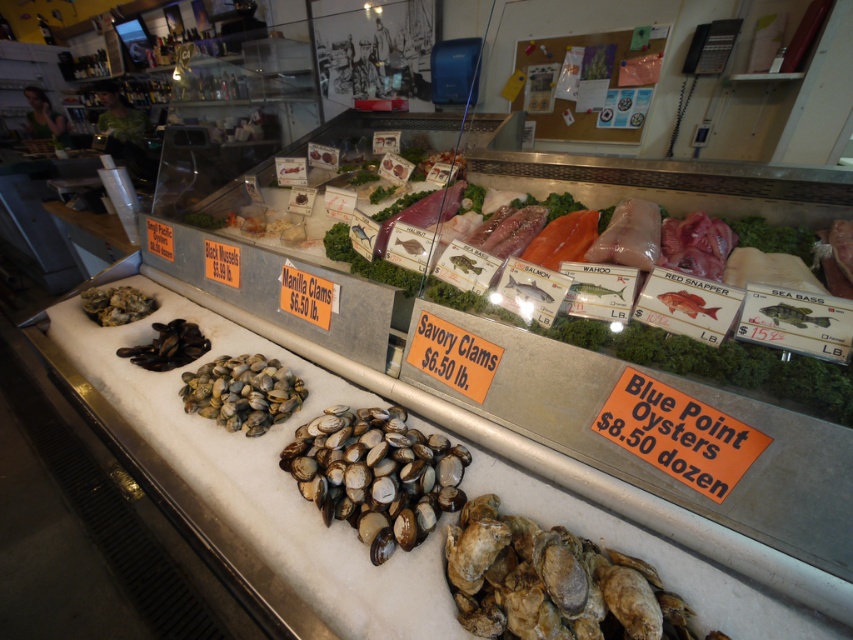
You are a customer at the seafood market and want to choose between the brown matte oyster at lower right and the white glossy clam at center. Which one takes up more space in the display case?

The white glossy clam at center takes up more space than the brown matte oyster at lower right.

You are a customer at the seafood market and want to buy the brown matte oyster at lower right and the black matte mussels at center. The store has a minimum size requirement of 10 cm for each item. Can you determine if both items meet the size requirement?

The brown matte oyster at lower right is bigger than the black matte mussels at center. However, without specific measurements, it is impossible to confirm if both items meet the 10 cm requirement. Please check the actual size labels or ask a staff member for assistance.